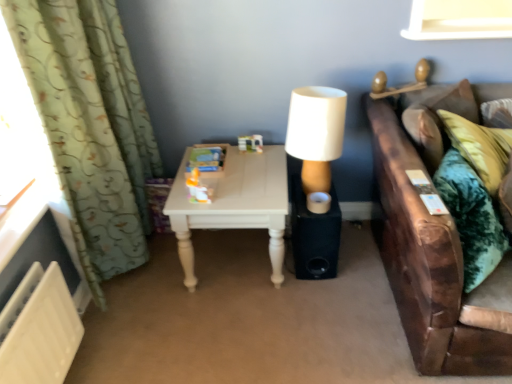
Question: In terms of width, does translucent plastic toy at center look wider or thinner when compared to black matte speaker at lower right?

Choices:
 (A) wide
 (B) thin

Answer: (B)

Question: Considering the positions of translucent plastic toy at center and black matte speaker at lower right in the image, is translucent plastic toy at center taller or shorter than black matte speaker at lower right?

Choices:
 (A) short
 (B) tall

Answer: (A)

Question: Which object is positioned farthest from the velvet green couch at right?

Choices:
 (A) green textured curtain at left
 (B) white matte lampshade at center
 (C) black matte speaker at lower right
 (D) translucent plastic toy at center
 (E) white painted wood table at center

Answer: (A)

Question: Estimate the real-world distances between objects in this image. Which object is farther from the translucent plastic toy at center?

Choices:
 (A) black matte speaker at lower right
 (B) velvet green couch at right
 (C) white matte lampshade at center
 (D) green textured curtain at left
 (E) white painted wood table at center

Answer: (B)